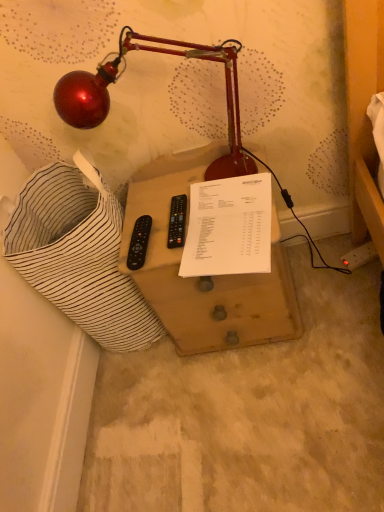
Question: Should I look upward or downward to see white paper at center?

Choices:
 (A) up
 (B) down

Answer: (A)

Question: Is black plastic remote at center, acting as the second control starting from the left, bigger than white paper at center?

Choices:
 (A) yes
 (B) no

Answer: (B)

Question: From the image's perspective, does black plastic remote at center, marked as the 1th control in a right-to-left arrangement, appear lower than white paper at center?

Choices:
 (A) no
 (B) yes

Answer: (A)

Question: Does black plastic remote at center, marked as the 1th control in a right-to-left arrangement, have a lesser height compared to white paper at center?

Choices:
 (A) no
 (B) yes

Answer: (B)

Question: Is black plastic remote at center, acting as the second control starting from the left, taller than white paper at center?

Choices:
 (A) no
 (B) yes

Answer: (A)

Question: Considering the relative sizes of black plastic remote at center, marked as the 1th control in a right-to-left arrangement, and white paper at center in the image provided, is black plastic remote at center, marked as the 1th control in a right-to-left arrangement, wider than white paper at center?

Choices:
 (A) no
 (B) yes

Answer: (A)

Question: Is black plastic remote at center, marked as the 1th control in a right-to-left arrangement, in contact with white paper at center?

Choices:
 (A) no
 (B) yes

Answer: (A)

Question: Could you tell me if metallic red lamp at upper left is turned towards white paper at center?

Choices:
 (A) no
 (B) yes

Answer: (B)

Question: Is metallic red lamp at upper left not near white paper at center?

Choices:
 (A) no
 (B) yes

Answer: (A)

Question: Can we say metallic red lamp at upper left lies outside white paper at center?

Choices:
 (A) yes
 (B) no

Answer: (A)

Question: From a real-world perspective, is metallic red lamp at upper left on white paper at center?

Choices:
 (A) no
 (B) yes

Answer: (B)

Question: Can you confirm if metallic red lamp at upper left is positioned to the left of white paper at center?

Choices:
 (A) yes
 (B) no

Answer: (A)

Question: Is metallic red lamp at upper left thinner than white paper at center?

Choices:
 (A) no
 (B) yes

Answer: (B)

Question: Does black plastic remote at center, marked as the 1th control in a right-to-left arrangement, touch wooden drawer at center?

Choices:
 (A) no
 (B) yes

Answer: (A)